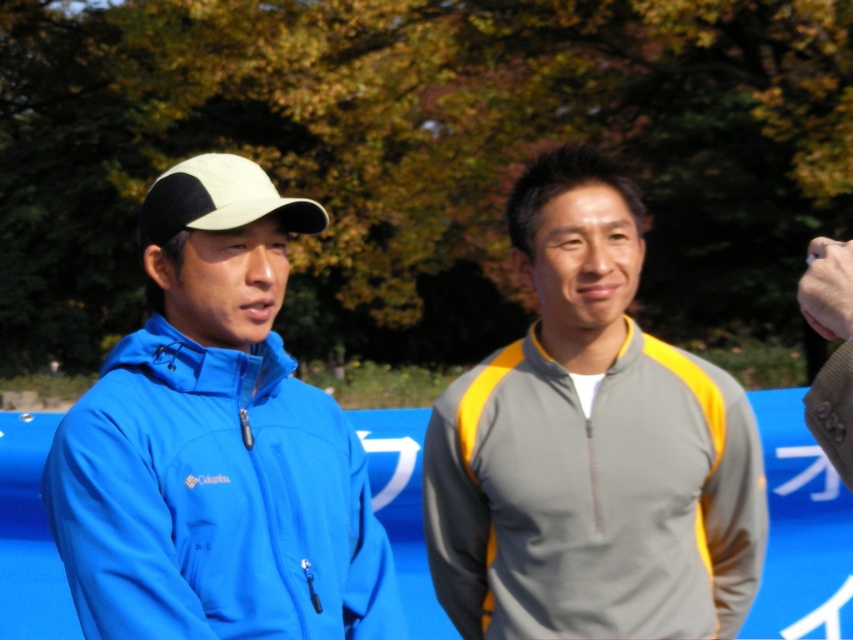
Question: Which of these objects is positioned farthest from the blue fleece jacket at left?

Choices:
 (A) white matte baseball cap at center
 (B) gray/yellow zip-up jacket at center

Answer: (B)

Question: Which of the following is the farthest from the observer?

Choices:
 (A) (285, 212)
 (B) (167, 236)
 (C) (675, 612)

Answer: (C)

Question: Is blue fleece jacket at left smaller than white matte baseball cap at center?

Choices:
 (A) yes
 (B) no

Answer: (B)

Question: Is blue fleece jacket at left bigger than gray/yellow zip-up jacket at center?

Choices:
 (A) no
 (B) yes

Answer: (A)

Question: Estimate the real-world distances between objects in this image. Which object is farther from the gray/yellow zip-up jacket at center?

Choices:
 (A) white matte baseball cap at center
 (B) blue fleece jacket at left

Answer: (A)

Question: Does blue fleece jacket at left have a lesser width compared to gray/yellow zip-up jacket at center?

Choices:
 (A) no
 (B) yes

Answer: (B)